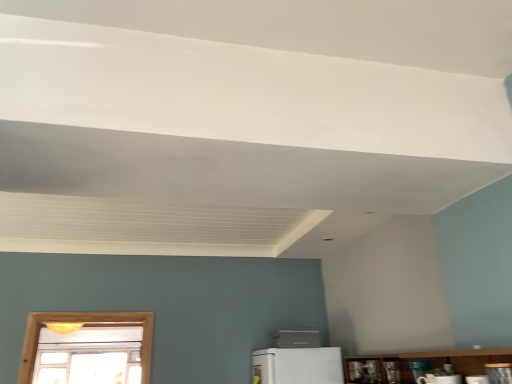
What do you see at coordinates (298, 338) in the screenshot? I see `white plastic air conditioner at center, which ranks as the 4th appliance in front-to-back order` at bounding box center [298, 338].

What do you see at coordinates (439, 379) in the screenshot? I see `white glossy microwave at lower center, which is the third appliance in back-to-front order` at bounding box center [439, 379].

Describe the element at coordinates (439, 360) in the screenshot. Image resolution: width=512 pixels, height=384 pixels. I see `wooden at lower right` at that location.

The height and width of the screenshot is (384, 512). I want to click on metallic silver toaster at lower right, which appears as the second appliance when viewed from the back, so 420,368.

Locate an element on the screen. This screenshot has height=384, width=512. metallic silver toaster at lower right, which ranks as the third appliance in left-to-right order is located at coordinates (499, 373).

Where is `the 1st appliance below when counting from the metallic silver toaster at lower right, which appears as the fourth appliance when ordered from the bottom (from the image's perspective)`? This screenshot has width=512, height=384. the 1st appliance below when counting from the metallic silver toaster at lower right, which appears as the fourth appliance when ordered from the bottom (from the image's perspective) is located at coordinates (439, 379).

Looking at this image, from the image's perspective, is metallic silver toaster at lower right, the 1th appliance positioned from the front, positioned above or below white glossy microwave at lower center, which appears as the third appliance when ordered from the bottom?

From the image's perspective, metallic silver toaster at lower right, the 1th appliance positioned from the front, appears above white glossy microwave at lower center, which appears as the third appliance when ordered from the bottom.

Is metallic silver toaster at lower right, the fourth appliance when ordered from back to front, positioned far away from white glossy microwave at lower center, which is the third appliance in back-to-front order?

metallic silver toaster at lower right, the fourth appliance when ordered from back to front, is near white glossy microwave at lower center, which is the third appliance in back-to-front order, not far away.

Would you say metallic silver toaster at lower right, which appears as the fourth appliance when ordered from the bottom, is outside white glossy microwave at lower center, the second appliance from the top?

Yes.

Is white glossy microwave at lower center, arranged as the second appliance when viewed from the front, to the right of white plastic air conditioner at center, which ranks as the 4th appliance in front-to-back order, from the viewer's perspective?

Indeed, white glossy microwave at lower center, arranged as the second appliance when viewed from the front, is positioned on the right side of white plastic air conditioner at center, which ranks as the 4th appliance in front-to-back order.

Consider the image. Is white glossy microwave at lower center, which appears as the third appliance when ordered from the bottom, taller or shorter than white plastic air conditioner at center, the fourth appliance in the right-to-left sequence?

white glossy microwave at lower center, which appears as the third appliance when ordered from the bottom, is shorter than white plastic air conditioner at center, the fourth appliance in the right-to-left sequence.

In the scene shown: Would you say white glossy microwave at lower center, the 3th appliance viewed from the right, is outside white plastic air conditioner at center, the 4th appliance in the top-to-bottom sequence?

white glossy microwave at lower center, the 3th appliance viewed from the right, is positioned outside white plastic air conditioner at center, the 4th appliance in the top-to-bottom sequence.

Is white glossy microwave at lower center, the 3th appliance viewed from the right, turned away from white plastic air conditioner at center, the 4th appliance in the top-to-bottom sequence?

white glossy microwave at lower center, the 3th appliance viewed from the right, is not turned away from white plastic air conditioner at center, the 4th appliance in the top-to-bottom sequence.

Considering the positions of objects white glossy microwave at lower center, which appears as the third appliance when ordered from the bottom, and wooden at lower right in the image provided, who is more to the right, white glossy microwave at lower center, which appears as the third appliance when ordered from the bottom, or wooden at lower right?

From the viewer's perspective, wooden at lower right appears more on the right side.

Is white glossy microwave at lower center, the 3th appliance viewed from the right, not inside wooden at lower right?

white glossy microwave at lower center, the 3th appliance viewed from the right, is positioned outside wooden at lower right.

Find the location of a particular element. The height and width of the screenshot is (384, 512). shelf above the white glossy microwave at lower center, which appears as the third appliance when ordered from the bottom (from a real-world perspective) is located at coordinates (439, 360).

Is point (430, 379) closer to camera compared to point (506, 353)?

No, it is behind (506, 353).

Is metallic silver toaster at lower right, the 1th appliance positioned from the front, behind wooden at lower right?

No, it is not.

From the image's perspective, between metallic silver toaster at lower right, the second appliance viewed from the right, and wooden at lower right, which one is located above?

metallic silver toaster at lower right, the second appliance viewed from the right, appears higher in the image.

Find the location of a particular element. shelf behind the metallic silver toaster at lower right, which appears as the fourth appliance when ordered from the bottom is located at coordinates (439, 360).

Is metallic silver toaster at lower right, the fourth appliance when ordered from left to right, located outside metallic silver toaster at lower right, which ranks as the third appliance in left-to-right order?

That's correct, metallic silver toaster at lower right, the fourth appliance when ordered from left to right, is outside of metallic silver toaster at lower right, which ranks as the third appliance in left-to-right order.

Which object is positioned more to the left, metallic silver toaster at lower right, which appears as the second appliance when viewed from the back, or metallic silver toaster at lower right, which appears as the fourth appliance when ordered from the bottom?

From the viewer's perspective, metallic silver toaster at lower right, which appears as the fourth appliance when ordered from the bottom, appears more on the left side.

Between metallic silver toaster at lower right, the fourth appliance when ordered from left to right, and metallic silver toaster at lower right, the fourth appliance when ordered from back to front, which one has smaller width?

metallic silver toaster at lower right, the fourth appliance when ordered from left to right, is thinner.

How different are the orientations of metallic silver toaster at lower right, the fourth appliance when ordered from left to right, and metallic silver toaster at lower right, which ranks as the third appliance in left-to-right order, in degrees?

The angle between the facing direction of metallic silver toaster at lower right, the fourth appliance when ordered from left to right, and the facing direction of metallic silver toaster at lower right, which ranks as the third appliance in left-to-right order, is 5.23 degrees.

Who is smaller, wooden at lower right or white glossy microwave at lower center, the 2th appliance in the left-to-right sequence?

With smaller size is white glossy microwave at lower center, the 2th appliance in the left-to-right sequence.

Which object is further away from the camera, wooden at lower right or white glossy microwave at lower center, which appears as the third appliance when ordered from the bottom?

wooden at lower right is behind.

Is wooden at lower right turned away from white glossy microwave at lower center, which appears as the third appliance when ordered from the bottom?

No, wooden at lower right is not facing the opposite direction of white glossy microwave at lower center, which appears as the third appliance when ordered from the bottom.

In the scene shown: Is wooden at lower right shorter than white glossy microwave at lower center, arranged as the second appliance when viewed from the front?

Incorrect, the height of wooden at lower right does not fall short of that of white glossy microwave at lower center, arranged as the second appliance when viewed from the front.

Looking at this image, is white plastic air conditioner at center, the 4th appliance in the top-to-bottom sequence, aimed at metallic silver toaster at lower right, arranged as the 3th appliance when viewed from the front?

No, white plastic air conditioner at center, the 4th appliance in the top-to-bottom sequence, is not oriented towards metallic silver toaster at lower right, arranged as the 3th appliance when viewed from the front.

From the picture: Which of these two, white plastic air conditioner at center, which is the first appliance from left to right, or metallic silver toaster at lower right, marked as the 1th appliance in a right-to-left arrangement, is thinner?

metallic silver toaster at lower right, marked as the 1th appliance in a right-to-left arrangement.

Is white plastic air conditioner at center, the 4th appliance in the top-to-bottom sequence, positioned in front of metallic silver toaster at lower right, which is the 2th appliance from bottom to top?

No, white plastic air conditioner at center, the 4th appliance in the top-to-bottom sequence, is behind metallic silver toaster at lower right, which is the 2th appliance from bottom to top.

From the image's perspective, is white plastic air conditioner at center, the fourth appliance in the right-to-left sequence, on top of metallic silver toaster at lower right, which is the 2th appliance from bottom to top?

No, from the image's perspective, white plastic air conditioner at center, the fourth appliance in the right-to-left sequence, is not on top of metallic silver toaster at lower right, which is the 2th appliance from bottom to top.

From the white glossy microwave at lower center, the 3th appliance viewed from the right, count 1st appliance to the right and point to it. Please provide its 2D coordinates.

[(499, 373)]

From the image's perspective, which appliance is the 2nd one below the white glossy microwave at lower center, the 3th appliance viewed from the right? Please provide its 2D coordinates.

[(298, 338)]

Based on their spatial positions, is white glossy microwave at lower center, the second appliance from the top, or white plastic air conditioner at center, the fourth appliance in the right-to-left sequence, further from metallic silver toaster at lower right, positioned as the third appliance in top-to-bottom order?

Based on the image, white plastic air conditioner at center, the fourth appliance in the right-to-left sequence, appears to be further to metallic silver toaster at lower right, positioned as the third appliance in top-to-bottom order.

Based on their spatial positions, is white plastic air conditioner at center, which appears as the 1th appliance when viewed from the back, or metallic silver toaster at lower right, positioned as the third appliance in top-to-bottom order, closer to white glossy microwave at lower center, which appears as the third appliance when ordered from the bottom?

Among the two, metallic silver toaster at lower right, positioned as the third appliance in top-to-bottom order, is located nearer to white glossy microwave at lower center, which appears as the third appliance when ordered from the bottom.

From the image, which object appears to be nearer to white plastic air conditioner at center, the first appliance from the bottom, wooden at lower right or white glossy microwave at lower center, which is the third appliance in back-to-front order?

wooden at lower right.

From the image, which object appears to be nearer to white plastic air conditioner at center, the 4th appliance in the top-to-bottom sequence, metallic silver toaster at lower right, the 1th appliance positioned from the front, or white glossy microwave at lower center, which appears as the third appliance when ordered from the bottom?

white glossy microwave at lower center, which appears as the third appliance when ordered from the bottom, lies closer to white plastic air conditioner at center, the 4th appliance in the top-to-bottom sequence, than the other object.

When comparing their distances from wooden at lower right, does metallic silver toaster at lower right, positioned as the third appliance in top-to-bottom order, or metallic silver toaster at lower right, which ranks as the 1th appliance in top-to-bottom order, seem closer?

metallic silver toaster at lower right, positioned as the third appliance in top-to-bottom order, lies closer to wooden at lower right than the other object.

Based on their spatial positions, is white glossy microwave at lower center, the second appliance from the top, or wooden at lower right closer to metallic silver toaster at lower right, the second appliance viewed from the right?

Based on the image, white glossy microwave at lower center, the second appliance from the top, appears to be nearer to metallic silver toaster at lower right, the second appliance viewed from the right.

From the image, which object appears to be nearer to wooden at lower right, white glossy microwave at lower center, the 3th appliance viewed from the right, or white plastic air conditioner at center, which is the first appliance from left to right?

The object closer to wooden at lower right is white plastic air conditioner at center, which is the first appliance from left to right.

Considering their positions, is metallic silver toaster at lower right, the fourth appliance when ordered from back to front, positioned further to white glossy microwave at lower center, which appears as the third appliance when ordered from the bottom, than wooden at lower right?

Among the two, wooden at lower right is located further to white glossy microwave at lower center, which appears as the third appliance when ordered from the bottom.

Where is `shelf between white glossy microwave at lower center, the 3th appliance viewed from the right, and metallic silver toaster at lower right, which is the 2th appliance from bottom to top, from front to back`? The height and width of the screenshot is (384, 512). shelf between white glossy microwave at lower center, the 3th appliance viewed from the right, and metallic silver toaster at lower right, which is the 2th appliance from bottom to top, from front to back is located at coordinates (439, 360).

Image resolution: width=512 pixels, height=384 pixels. Identify the location of appliance between metallic silver toaster at lower right, the second appliance viewed from the right, and metallic silver toaster at lower right, which appears as the second appliance when viewed from the back, in the front-back direction. (439, 379).

Find the location of a particular element. appliance between white glossy microwave at lower center, the second appliance from the top, and white plastic air conditioner at center, the 4th appliance in the top-to-bottom sequence, along the z-axis is located at coordinates (420, 368).

The height and width of the screenshot is (384, 512). Find the location of `shelf between metallic silver toaster at lower right, which ranks as the 1th appliance in top-to-bottom order, and metallic silver toaster at lower right, which appears as the second appliance when viewed from the back, along the z-axis`. shelf between metallic silver toaster at lower right, which ranks as the 1th appliance in top-to-bottom order, and metallic silver toaster at lower right, which appears as the second appliance when viewed from the back, along the z-axis is located at coordinates (439, 360).